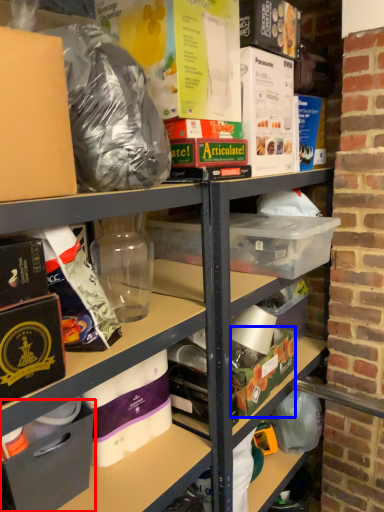
Question: Which point is further to the camera, box (highlighted by a red box) or box (highlighted by a blue box)?

Choices:
 (A) box
 (B) box

Answer: (B)